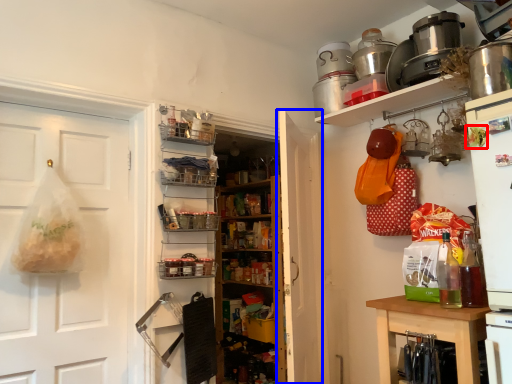
Question: Which object appears farthest to the camera in this image, food (highlighted by a red box) or door (highlighted by a blue box)?

Choices:
 (A) food
 (B) door

Answer: (B)